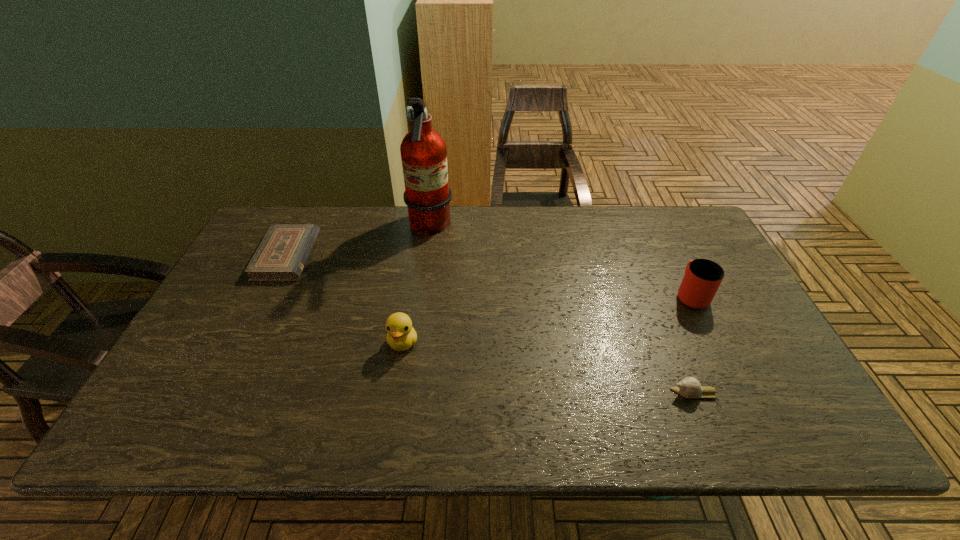
Locate an element on the screen. object present at the far left corner is located at coordinates (281, 256).

The width and height of the screenshot is (960, 540). I want to click on vacant area at the far edge, so click(x=526, y=216).

At what (x,y) coordinates should I click in order to perform the action: click on free space at the near edge of the desktop. Please return your answer as a coordinate pair (x, y). The height and width of the screenshot is (540, 960). Looking at the image, I should click on (517, 411).

You are a GUI agent. You are given a task and a screenshot of the screen. Output one action in this format:
    pyautogui.click(x=<x>, y=<y>)
    Task: Click on the blank space at the left edge of the desktop
    
    Given the screenshot: What is the action you would take?
    pyautogui.click(x=228, y=387)

Identify the location of free space at the far right corner of the desktop. This screenshot has height=540, width=960. point(673,219).

The height and width of the screenshot is (540, 960). In order to click on vacant space in between the tallest object and the nearest object in this screenshot , I will do `click(563, 310)`.

You are a GUI agent. You are given a task and a screenshot of the screen. Output one action in this format:
    pyautogui.click(x=<x>, y=<y>)
    Task: Click on the free area in between the rightmost object and the leftmost object
    This screenshot has height=540, width=960.
    Given the screenshot: What is the action you would take?
    pyautogui.click(x=489, y=275)

The height and width of the screenshot is (540, 960). I want to click on vacant area that lies between the tallest object and the fourth tallest object, so click(563, 310).

This screenshot has height=540, width=960. I want to click on vacant area that lies between the duck and the tallest object, so click(417, 285).

The image size is (960, 540). I want to click on free spot between the cup and the duck, so click(547, 319).